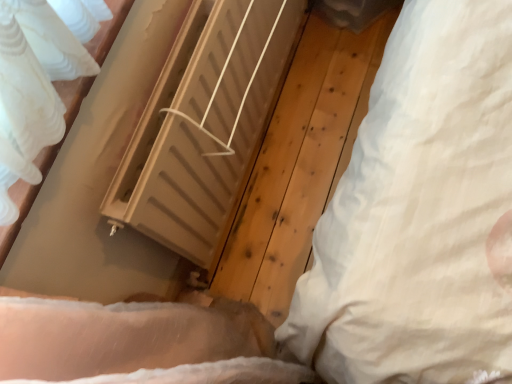
Question: In terms of width, does matte beige radiator at center look wider or thinner when compared to white soft pillow at right?

Choices:
 (A) wide
 (B) thin

Answer: (A)

Question: Choose the correct answer: Is matte beige radiator at center inside white soft pillow at right or outside it?

Choices:
 (A) inside
 (B) outside

Answer: (B)

Question: Considering their positions, is matte beige radiator at center located in front of or behind white soft pillow at right?

Choices:
 (A) front
 (B) behind

Answer: (B)

Question: In terms of height, does white soft pillow at right look taller or shorter compared to matte beige radiator at center?

Choices:
 (A) tall
 (B) short

Answer: (A)

Question: From the image's perspective, is white soft pillow at right above or below matte beige radiator at center?

Choices:
 (A) above
 (B) below

Answer: (B)

Question: Relative to matte beige radiator at center, is white soft pillow at right in front or behind?

Choices:
 (A) front
 (B) behind

Answer: (A)

Question: Looking at the image, does white soft pillow at right seem bigger or smaller compared to matte beige radiator at center?

Choices:
 (A) small
 (B) big

Answer: (A)